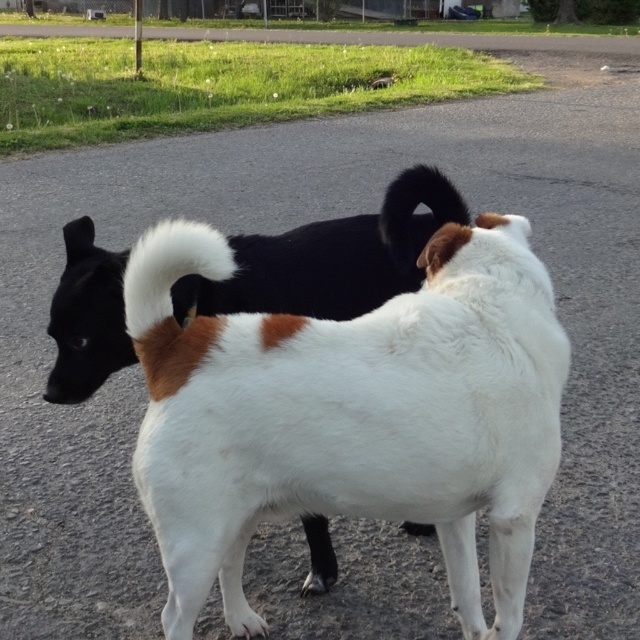
You are standing at the point marked by the coordinates point (422, 532) in the image. You want to walk to the fence in the background. How far will you have to walk from your current position to reach the fence?

The distance between the point (422, 532) and the viewer is 8.93 feet. Since you are standing at the point, the distance to the fence would depend on the total distance from the viewer to the fence, which isn not provided in the scene description. Therefore, I cannot determine the exact distance you need to walk.

You are a photographer trying to capture both the white fur dog at center and the black fur tail at upper center in a single shot. Based on their positions, which dog should you adjust your camera angle to focus on first to ensure both are in frame?

You should focus on the white fur dog at center first since it is positioned to the left of the black fur tail at upper center, so adjusting the angle to include the leftmost subject ensures the right side subject is also captured.